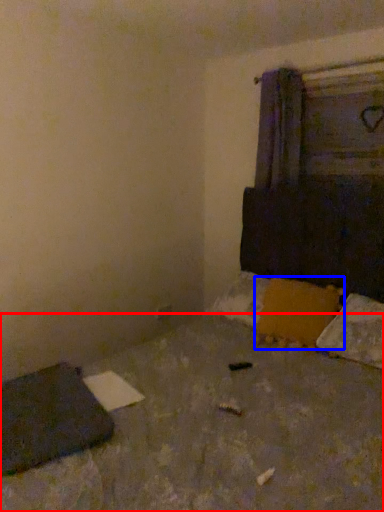
Question: Which of the following is the farthest to the observer, concrete (highlighted by a red box) or pillow (highlighted by a blue box)?

Choices:
 (A) concrete
 (B) pillow

Answer: (B)